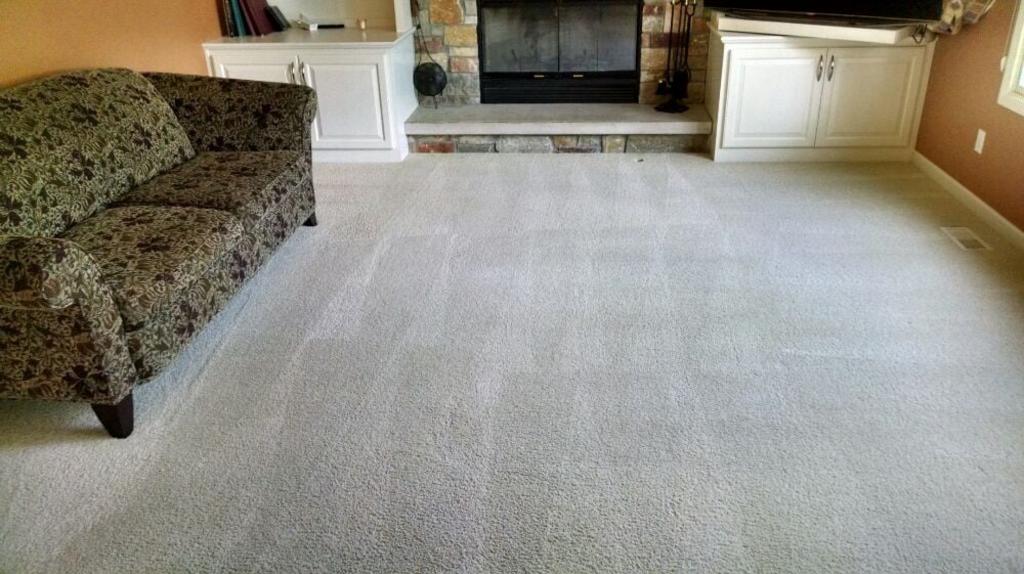
Find the location of `handle`. handle is located at coordinates (817, 65).